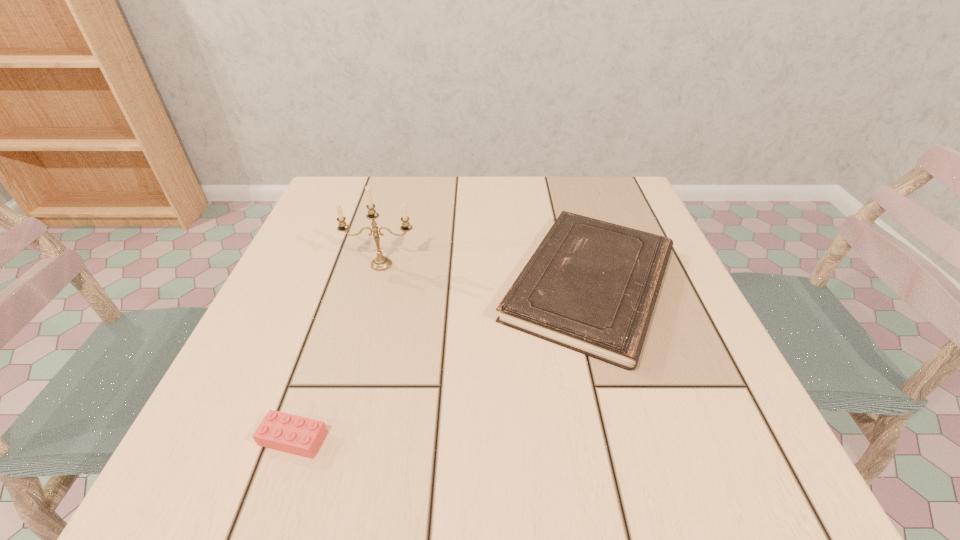
Find the location of `the tallest object`. the tallest object is located at coordinates (380, 263).

Where is `the rightmost object`? The image size is (960, 540). the rightmost object is located at coordinates tap(591, 286).

This screenshot has height=540, width=960. I want to click on Lego, so click(293, 434).

Where is `the shortest object`? the shortest object is located at coordinates (293, 434).

I want to click on vacant space located on the front of the tallest object, so click(350, 380).

Identify the location of vacant region located 0.120m on the left of the paperback book. The width and height of the screenshot is (960, 540). (431, 284).

Find the location of `vacant area located 0.300m on the right of the Lego`. vacant area located 0.300m on the right of the Lego is located at coordinates (544, 438).

Find the location of `object at the far edge`. object at the far edge is located at coordinates (591, 286).

You are a GUI agent. You are given a task and a screenshot of the screen. Output one action in this format:
    pyautogui.click(x=<x>, y=<y>)
    Task: Click on the object located in the near edge section of the desktop
    
    Given the screenshot: What is the action you would take?
    pyautogui.click(x=293, y=434)

The height and width of the screenshot is (540, 960). Find the location of `candle that is positioned at the left edge`. candle that is positioned at the left edge is located at coordinates (380, 263).